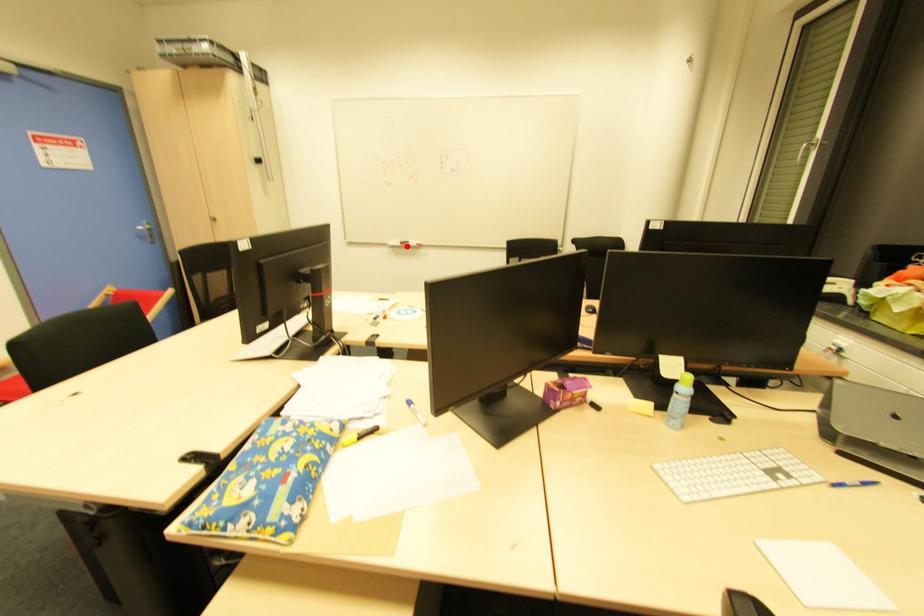
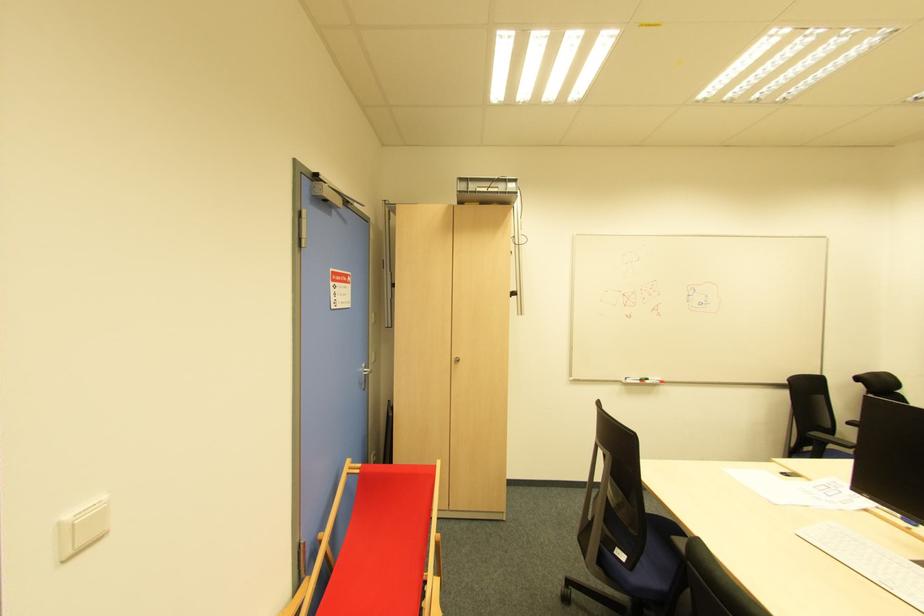
The point at the highlighted location is marked in the first image. Where is the corresponding point in the second image?

(647, 383)